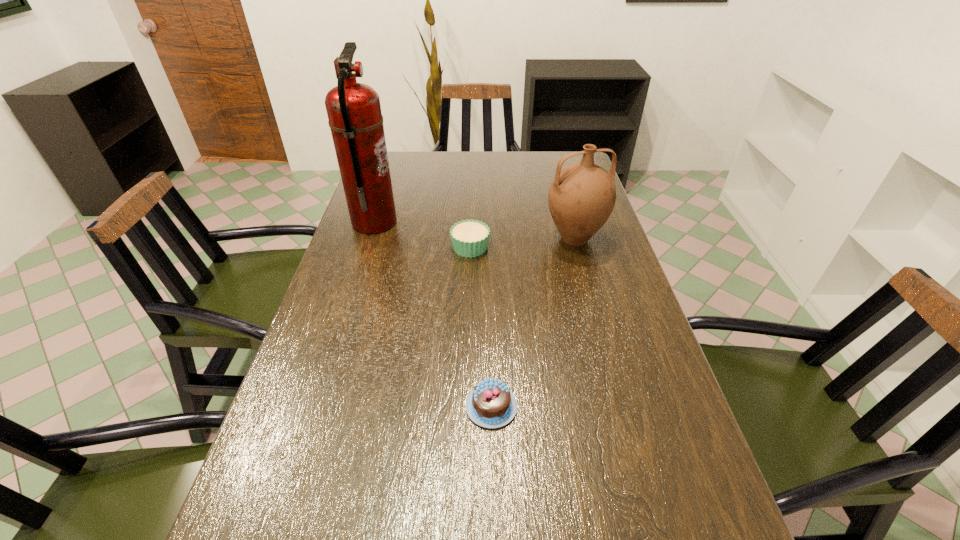
Locate an element on the screen. the tallest object is located at coordinates (354, 112).

Where is `the leftmost object`? The height and width of the screenshot is (540, 960). the leftmost object is located at coordinates (354, 112).

Where is `the rightmost object`? the rightmost object is located at coordinates (581, 198).

Locate an element on the screen. This screenshot has height=540, width=960. pitcher is located at coordinates click(581, 198).

At what (x,y) coordinates should I click in order to perform the action: click on cupcake. Please return your answer as a coordinate pair (x, y). This screenshot has height=540, width=960. Looking at the image, I should click on (469, 238).

Find the location of a particular element. The width and height of the screenshot is (960, 540). the nearest object is located at coordinates (491, 404).

Image resolution: width=960 pixels, height=540 pixels. Find the location of `free space located on the nozzle side of the fire extinguisher`. free space located on the nozzle side of the fire extinguisher is located at coordinates (500, 222).

This screenshot has height=540, width=960. I want to click on vacant area located on the back of the rightmost object, so click(565, 205).

Locate an element on the screen. The width and height of the screenshot is (960, 540). free space located 0.080m on the front of the cupcake is located at coordinates (469, 278).

Image resolution: width=960 pixels, height=540 pixels. Identify the location of vacant space located 0.340m on the back of the chocolate cake. (489, 278).